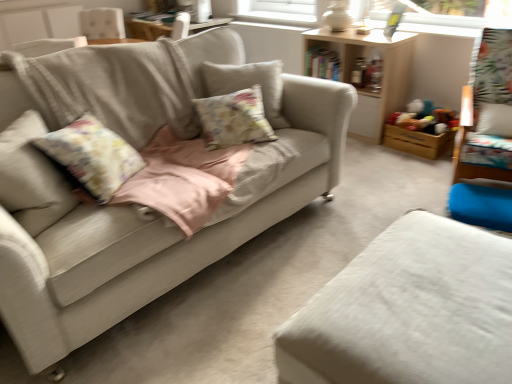
Question: Is the depth of wooden shelf at upper center less than that of white fabric ottoman at lower right, the 2th studio couch in the left-to-right sequence?

Choices:
 (A) no
 (B) yes

Answer: (A)

Question: Is wooden shelf at upper center wider than white fabric ottoman at lower right, positioned as the first studio couch in right-to-left order?

Choices:
 (A) yes
 (B) no

Answer: (B)

Question: Does wooden shelf at upper center come behind white fabric ottoman at lower right, the 2th studio couch in the left-to-right sequence?

Choices:
 (A) yes
 (B) no

Answer: (A)

Question: Can you confirm if wooden shelf at upper center is taller than white fabric ottoman at lower right, positioned as the first studio couch in right-to-left order?

Choices:
 (A) no
 (B) yes

Answer: (B)

Question: Can you confirm if wooden shelf at upper center is positioned to the right of white fabric ottoman at lower right, positioned as the first studio couch in right-to-left order?

Choices:
 (A) yes
 (B) no

Answer: (A)

Question: From a real-world perspective, relative to light beige fabric couch at center, the second studio couch from the right, is white fabric ottoman at lower right, positioned as the first studio couch in right-to-left order, vertically above or below?

Choices:
 (A) below
 (B) above

Answer: (A)

Question: Considering the positions of white fabric ottoman at lower right, the 2th studio couch in the left-to-right sequence, and light beige fabric couch at center, the 1th studio couch viewed from the left, in the image, is white fabric ottoman at lower right, the 2th studio couch in the left-to-right sequence, wider or thinner than light beige fabric couch at center, the 1th studio couch viewed from the left,?

Choices:
 (A) wide
 (B) thin

Answer: (B)

Question: From the image's perspective, is white fabric ottoman at lower right, positioned as the first studio couch in right-to-left order, above or below light beige fabric couch at center, the second studio couch from the right?

Choices:
 (A) above
 (B) below

Answer: (B)

Question: Is point (377, 344) closer or farther from the camera than point (336, 150)?

Choices:
 (A) closer
 (B) farther

Answer: (A)

Question: Is wooden shelf at upper center taller or shorter than wooden swivel chair at right?

Choices:
 (A) short
 (B) tall

Answer: (A)

Question: Do you think wooden shelf at upper center is within wooden swivel chair at right, or outside of it?

Choices:
 (A) inside
 (B) outside

Answer: (B)

Question: From the image's perspective, is wooden shelf at upper center positioned above or below wooden swivel chair at right?

Choices:
 (A) below
 (B) above

Answer: (B)

Question: Is point (399, 77) positioned closer to the camera than point (487, 130)?

Choices:
 (A) closer
 (B) farther

Answer: (B)

Question: Considering the positions of point (435, 140) and point (249, 96), is point (435, 140) closer or farther from the camera than point (249, 96)?

Choices:
 (A) closer
 (B) farther

Answer: (B)

Question: Do you think wooden toy box at right is within fluffy fabric pillow at center, or outside of it?

Choices:
 (A) inside
 (B) outside

Answer: (B)